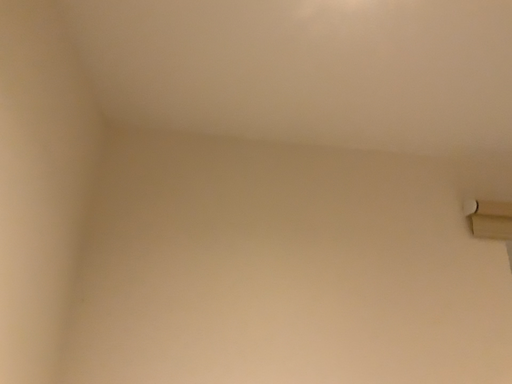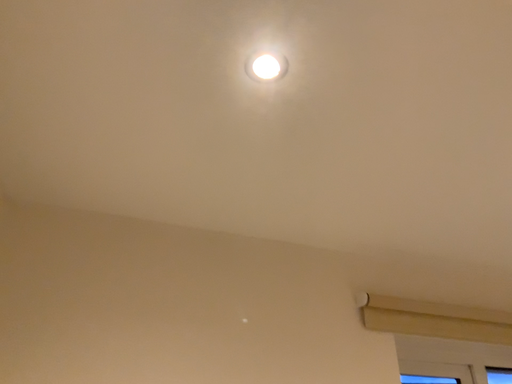
Question: How did the camera likely rotate when shooting the video?

Choices:
 (A) rotated right
 (B) rotated left

Answer: (A)